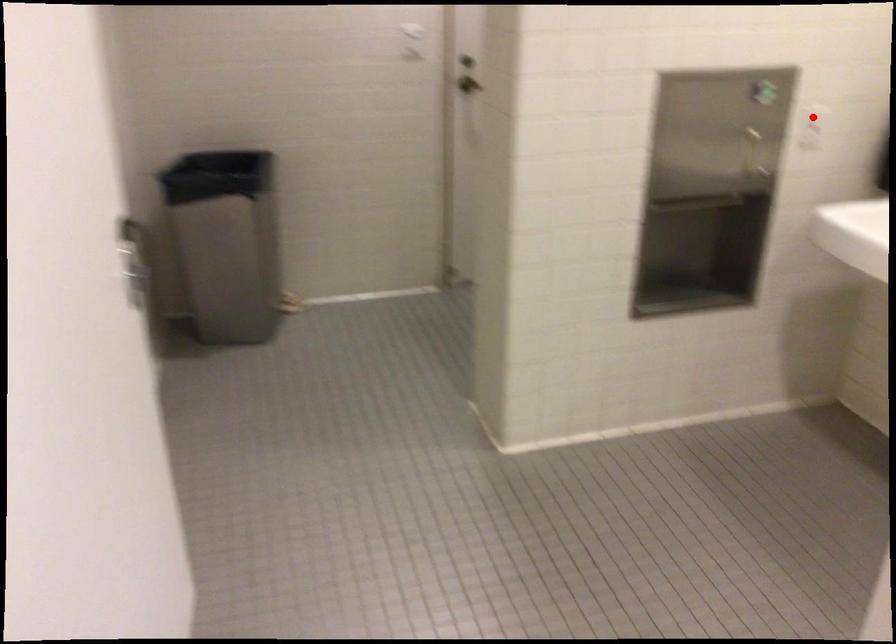
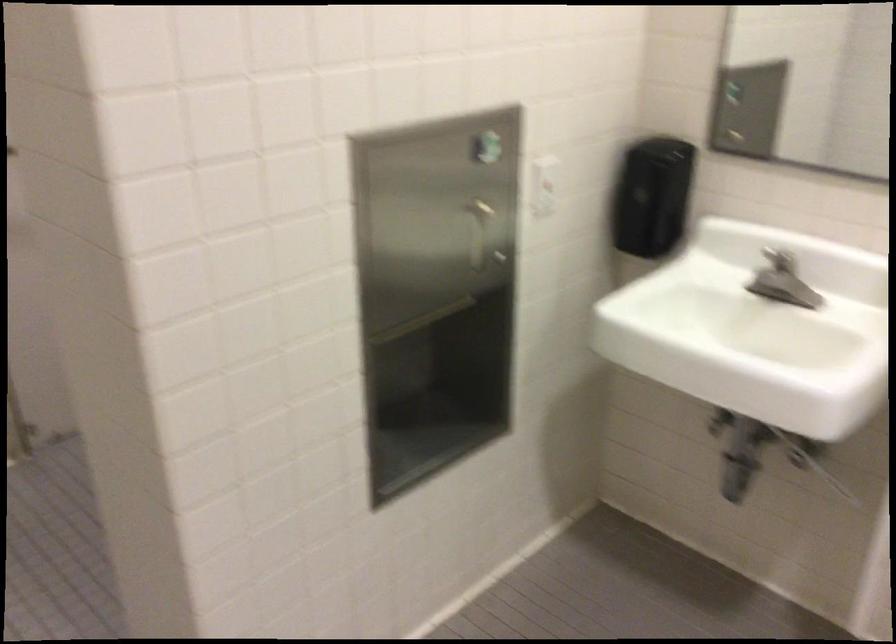
Question: I am providing you with two images of the same scene from different viewpoints. In image1, a red point is highlighted. Considering the same 3D point in image2, which of the following is correct?

Choices:
 (A) It is closer
 (B) It is farther

Answer: (A)